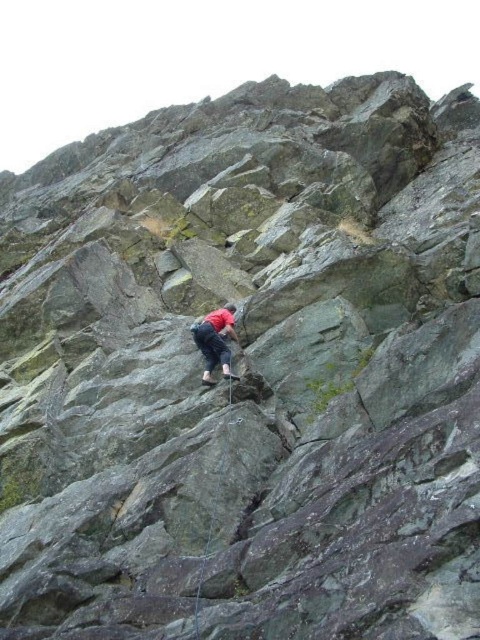
Can you confirm if red fabric shirt at center is positioned to the right of black nylon rope at center?

Incorrect, red fabric shirt at center is not on the right side of black nylon rope at center.

Who is more distant from viewer, (232, 376) or (229, 396)?

The point (232, 376) is more distant.

Which is in front, point (217, 333) or point (204, 547)?

Point (204, 547) is more forward.

This screenshot has height=640, width=480. I want to click on red fabric shirt at center, so click(x=215, y=340).